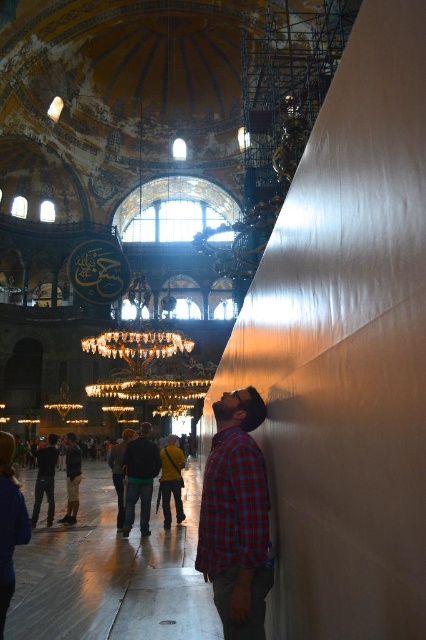
Question: Considering the relative positions of plaid shirt at right and dark blue jeans at center in the image provided, where is plaid shirt at right located with respect to dark blue jeans at center?

Choices:
 (A) below
 (B) above

Answer: (B)

Question: Observing the image, what is the correct spatial positioning of plaid shirt at right in reference to dark gray jeans at lower left?

Choices:
 (A) left
 (B) right

Answer: (B)

Question: Can you confirm if dark blue jeans at center is positioned to the right of dark gray jeans at lower left?

Choices:
 (A) no
 (B) yes

Answer: (B)

Question: Which object is the closest to the dark gray jeans at lower left?

Choices:
 (A) plaid shirt at right
 (B) dark blue jeans at center

Answer: (B)

Question: Considering the real-world distances, which object is closest to the dark gray jeans at lower left?

Choices:
 (A) plaid shirt at right
 (B) dark blue jeans at center

Answer: (B)

Question: Which point is closer to the camera taking this photo?

Choices:
 (A) (134, 512)
 (B) (48, 449)
 (C) (258, 531)

Answer: (C)